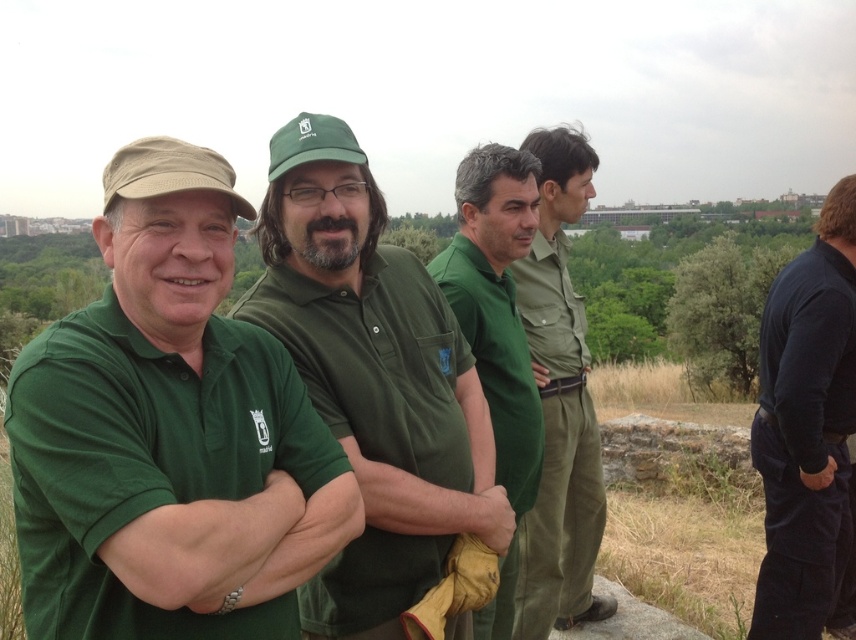
Question: Which point is closer to the camera?

Choices:
 (A) (522, 324)
 (B) (137, 460)

Answer: (B)

Question: Among these points, which one is farthest from the camera?

Choices:
 (A) (837, 392)
 (B) (542, 470)
 (C) (224, 509)

Answer: (A)

Question: Does green matte shirt at center appear over matte green uniform at center?

Choices:
 (A) yes
 (B) no

Answer: (A)

Question: Considering the relative positions of matte green polo shirt at left and green cotton shirt at center in the image provided, where is matte green polo shirt at left located with respect to green cotton shirt at center?

Choices:
 (A) left
 (B) right

Answer: (A)

Question: Is green matte shirt at left positioned behind dark blue fabric at right?

Choices:
 (A) no
 (B) yes

Answer: (A)

Question: Estimate the real-world distances between objects in this image. Which object is farther from the matte green uniform at center?

Choices:
 (A) dark blue fabric at right
 (B) matte green polo shirt at left
 (C) green cotton shirt at center
 (D) dark blue fabric pants at right

Answer: (D)